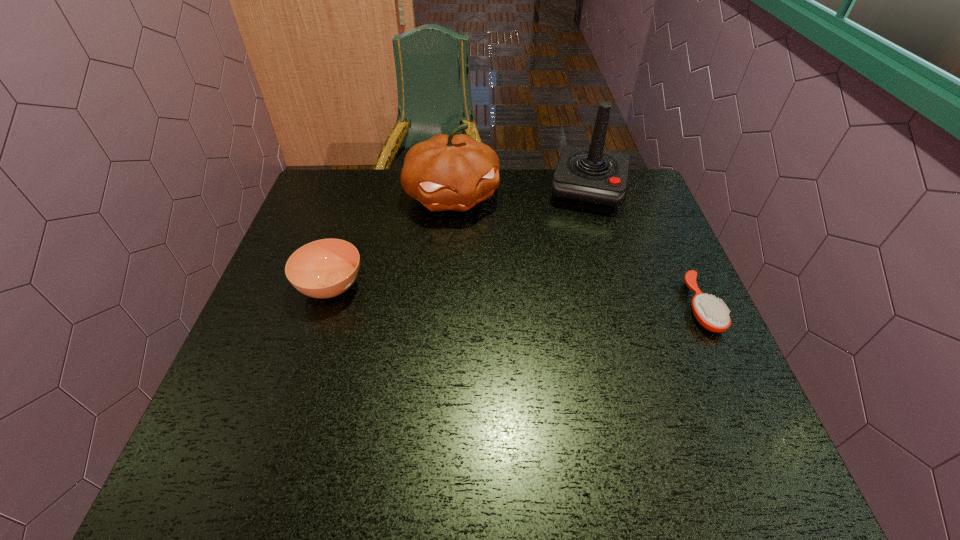
The image size is (960, 540). In order to click on free space in the image that satisfies the following two spatial constraints: 1. on the front side of the pumpkin; 2. on the left side of the rightmost object in this screenshot , I will do `click(444, 307)`.

The height and width of the screenshot is (540, 960). Identify the location of vacant space that satisfies the following two spatial constraints: 1. on the back side of the soup bowl; 2. on the left side of the second object from right to left. (362, 191).

You are a GUI agent. You are given a task and a screenshot of the screen. Output one action in this format:
    pyautogui.click(x=<x>, y=<y>)
    Task: Click on the free space that satisfies the following two spatial constraints: 1. on the front side of the rightmost object; 2. on the left side of the second tallest object
    
    Given the screenshot: What is the action you would take?
    pyautogui.click(x=444, y=307)